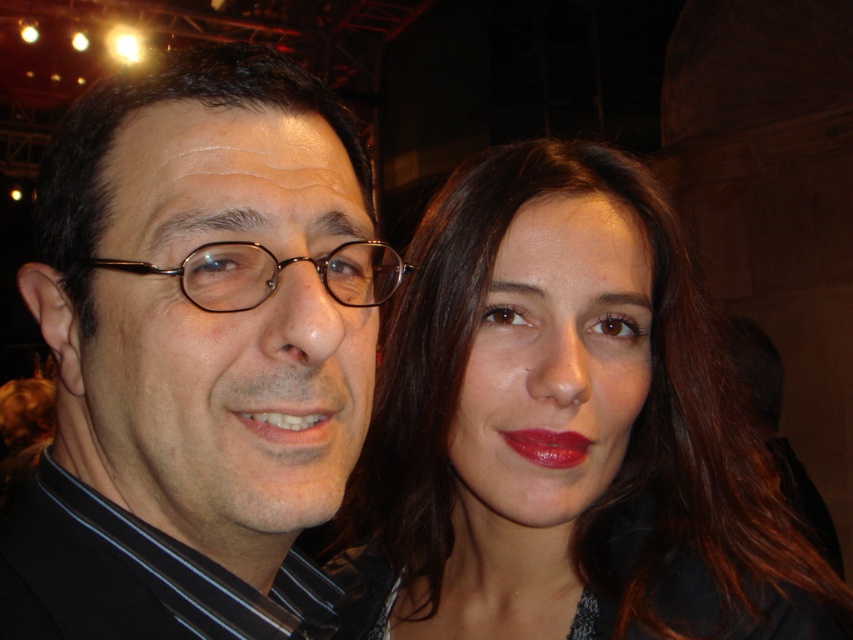
Consider the image. You are a photographer adjusting the focus on your camera. You need to ensure that both the matte black glasses at left and the woman on the right are in focus. Given their positions, which object is closer to the camera and might require adjusting the focus first?

The matte black glasses at left is located at point (194, 353), so it is closer to the camera than the woman on the right. Therefore, you should adjust the focus starting with the matte black glasses at left to ensure both are in focus.

You are a photographer adjusting your camera settings. You notice the matte black glasses at left and the matte red lipstick at center in your frame. Which object should you focus on first to ensure both are in sharp focus?

The matte black glasses at left is closer to the viewer than the matte red lipstick at center. To ensure both are in sharp focus, you should focus on the matte black glasses at left first, as it is closer and focusing there will maximize the depth of field coverage for both objects.